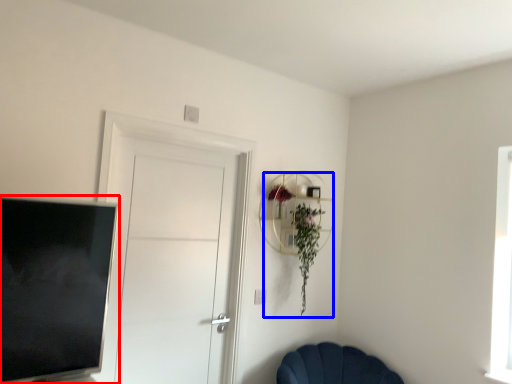
Question: Which of the following is the farthest to the observer, television (highlighted by a red box) or floral arrangement (highlighted by a blue box)?

Choices:
 (A) television
 (B) floral arrangement

Answer: (B)